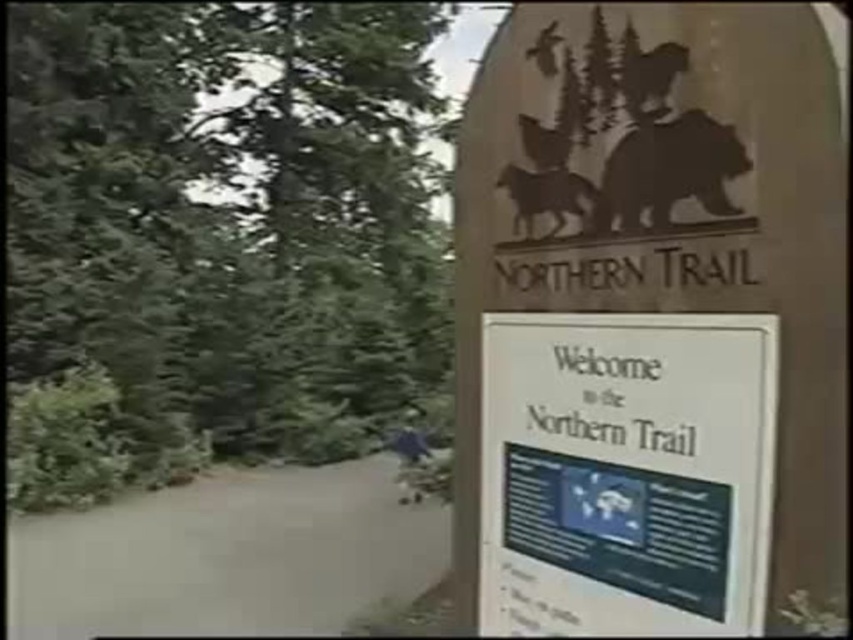
Question: Is white paper sign at center wider than brown matte bear at upper center?

Choices:
 (A) yes
 (B) no

Answer: (A)

Question: Which object appears closest to the camera in this image?

Choices:
 (A) silhouette bear at upper right
 (B) white paper sign at center

Answer: (B)

Question: Is green leafy tree at left above silhouette bear at upper right?

Choices:
 (A) yes
 (B) no

Answer: (B)

Question: Which of the following is the farthest from the observer?

Choices:
 (A) (753, 532)
 (B) (102, 154)
 (C) (505, 186)

Answer: (B)

Question: Which of the following is the closest to the observer?

Choices:
 (A) brown textured stone sign at upper right
 (B) white paper sign at center
 (C) green leafy tree at left

Answer: (A)

Question: Can you confirm if white paper sign at center is bigger than silhouette bear at upper right?

Choices:
 (A) yes
 (B) no

Answer: (A)